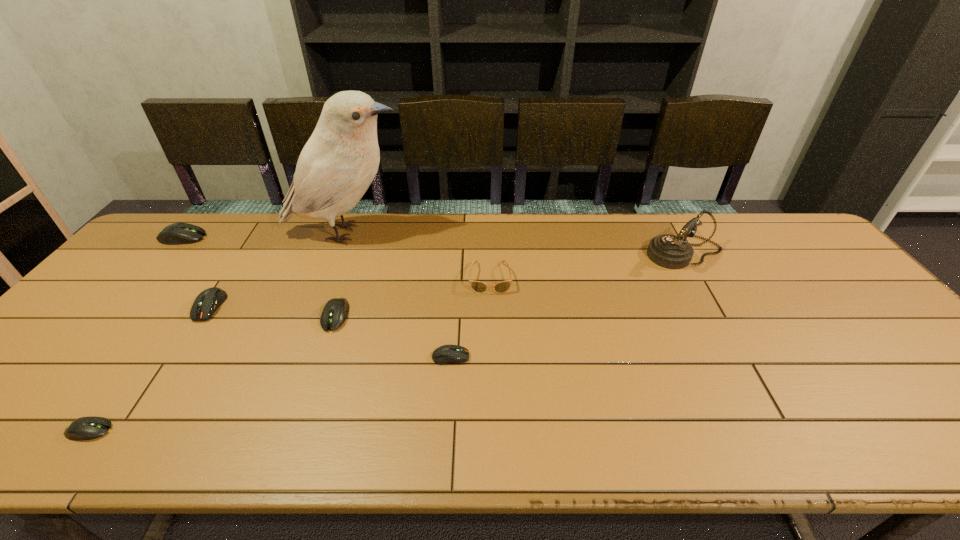
The height and width of the screenshot is (540, 960). What are the coordinates of `the tallest object` in the screenshot? It's located at (338, 163).

Where is `parakeet`? This screenshot has height=540, width=960. parakeet is located at coordinates (338, 163).

Identify the location of telephone. The height and width of the screenshot is (540, 960). (669, 251).

Locate an element on the screen. The image size is (960, 540). the rightmost object is located at coordinates (669, 251).

Image resolution: width=960 pixels, height=540 pixels. What are the coordinates of `the leftmost gray computer mouse` in the screenshot? It's located at (177, 233).

Locate an element on the screen. the farthest gray computer mouse is located at coordinates (177, 233).

At what (x,y) coordinates should I click in order to perform the action: click on sunglasses. Please return your answer as a coordinate pair (x, y). The image size is (960, 540). Looking at the image, I should click on (479, 287).

I want to click on the bigger dark computer equipment, so [x=207, y=302].

This screenshot has height=540, width=960. In order to click on the third computer mouse from left to right in this screenshot , I will do `click(207, 302)`.

The height and width of the screenshot is (540, 960). What are the coordinates of `the second biggest gray computer mouse` in the screenshot? It's located at (335, 312).